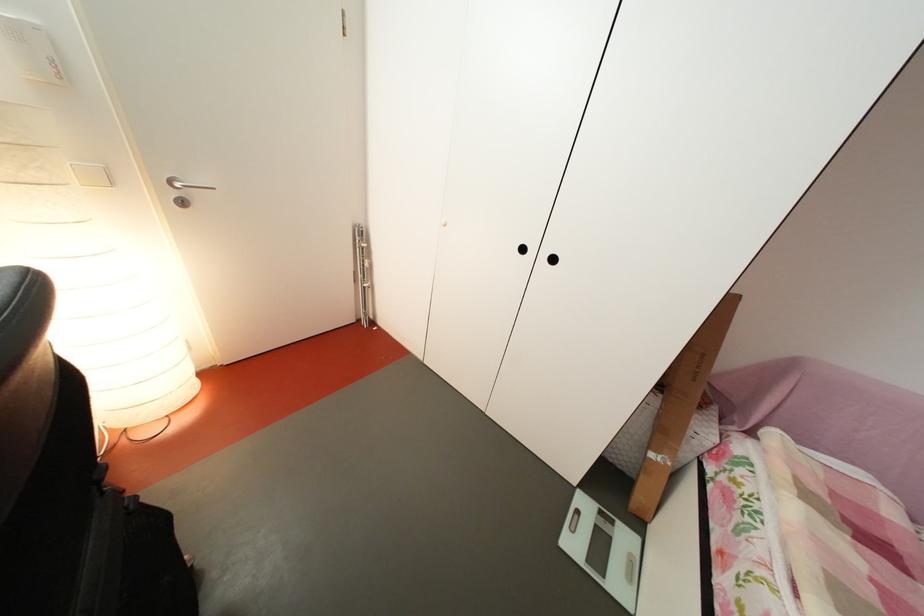
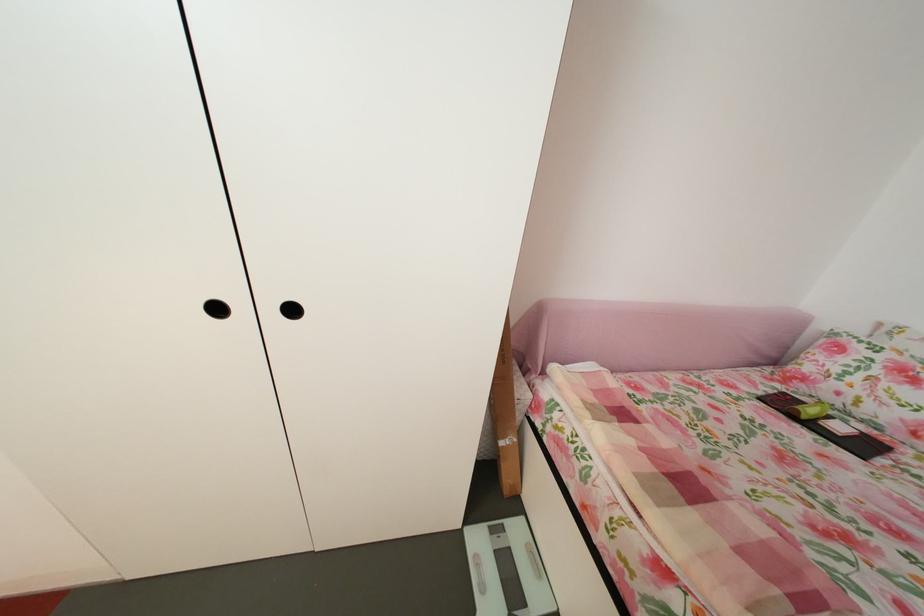
Question: Based on the continuous images, in which direction is the camera rotating? Reply with the corresponding letter.

Choices:
 (A) Left
 (B) Right
 (C) Up
 (D) Down

Answer: (B)